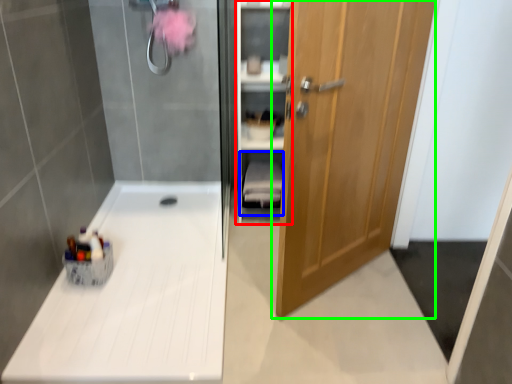
Question: Which is farther away from cabinet (highlighted by a red box)? shelf (highlighted by a blue box) or door (highlighted by a green box)?

Choices:
 (A) shelf
 (B) door

Answer: (B)